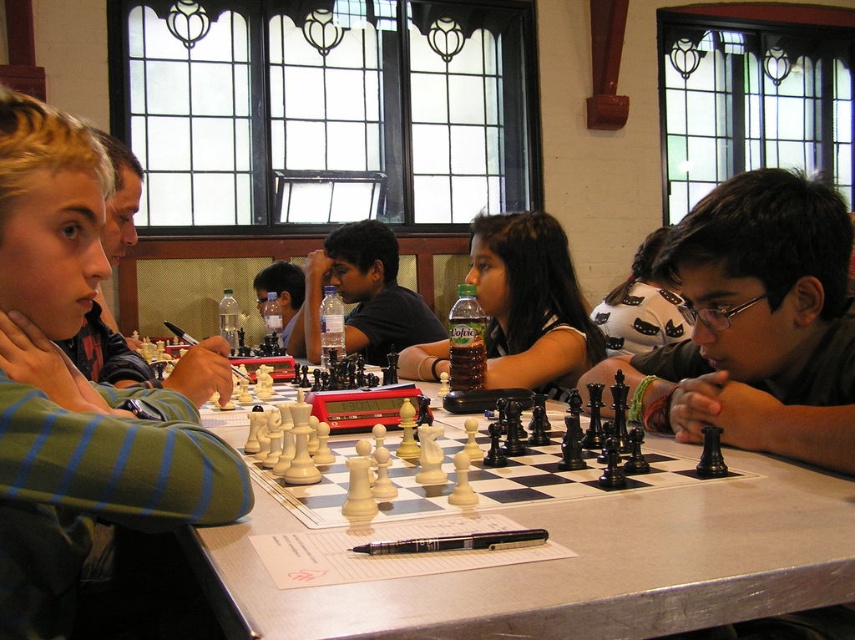
What do you see at coordinates (575, 566) in the screenshot?
I see `white glossy table at center` at bounding box center [575, 566].

Describe the element at coordinates (575, 566) in the screenshot. I see `white glossy table at center` at that location.

Find the location of a particular element. This screenshot has width=855, height=640. white glossy table at center is located at coordinates (575, 566).

Is white glossy table at center bigger than green striped shirt at upper left?

No.

Does white glossy table at center appear on the right side of green striped shirt at upper left?

Indeed, white glossy table at center is positioned on the right side of green striped shirt at upper left.

What do you see at coordinates (575, 566) in the screenshot? The height and width of the screenshot is (640, 855). I see `white glossy table at center` at bounding box center [575, 566].

Image resolution: width=855 pixels, height=640 pixels. In order to click on white glossy table at center in this screenshot , I will do `click(575, 566)`.

Does white glossy table at center have a greater height compared to smooth black chess set at center?

No, white glossy table at center is not taller than smooth black chess set at center.

Between point (771, 490) and point (304, 321), which one is positioned behind?

The point (304, 321) is behind.

The width and height of the screenshot is (855, 640). Find the location of `white glossy table at center`. white glossy table at center is located at coordinates (575, 566).